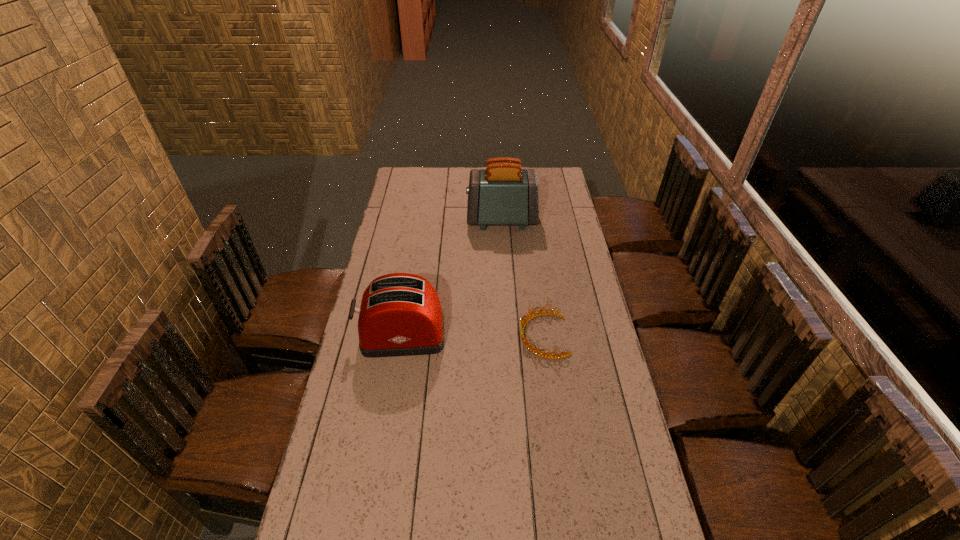
You are a GUI agent. You are given a task and a screenshot of the screen. Output one action in this format:
    pyautogui.click(x=<x>, y=<y>)
    Task: Click on the taller toaster
    This screenshot has height=540, width=960.
    Given the screenshot: What is the action you would take?
    pyautogui.click(x=502, y=194)

This screenshot has height=540, width=960. I want to click on the right toaster, so click(502, 194).

Locate an element on the screen. The height and width of the screenshot is (540, 960). the second tallest object is located at coordinates (400, 314).

At what (x,y) coordinates should I click in order to perform the action: click on the left toaster. Please return your answer as a coordinate pair (x, y). This screenshot has width=960, height=540. Looking at the image, I should click on (400, 314).

Where is `the shortest object`? the shortest object is located at coordinates (538, 352).

Where is `vacant region located on the front-facing side of the farthest object`? The image size is (960, 540). vacant region located on the front-facing side of the farthest object is located at coordinates (454, 220).

At what (x,y) coordinates should I click in order to perform the action: click on vacant region located on the front-facing side of the farthest object. Please return your answer as a coordinate pair (x, y). This screenshot has height=540, width=960. Looking at the image, I should click on (444, 220).

Where is `vacant space located on the front-facing side of the farthest object`? This screenshot has width=960, height=540. vacant space located on the front-facing side of the farthest object is located at coordinates (454, 220).

The image size is (960, 540). Identify the location of free region located 0.290m on the right of the shorter toaster. (525, 335).

Locate an element on the screen. vacant space positioned 0.240m on the front-facing side of the tiara is located at coordinates (452, 336).